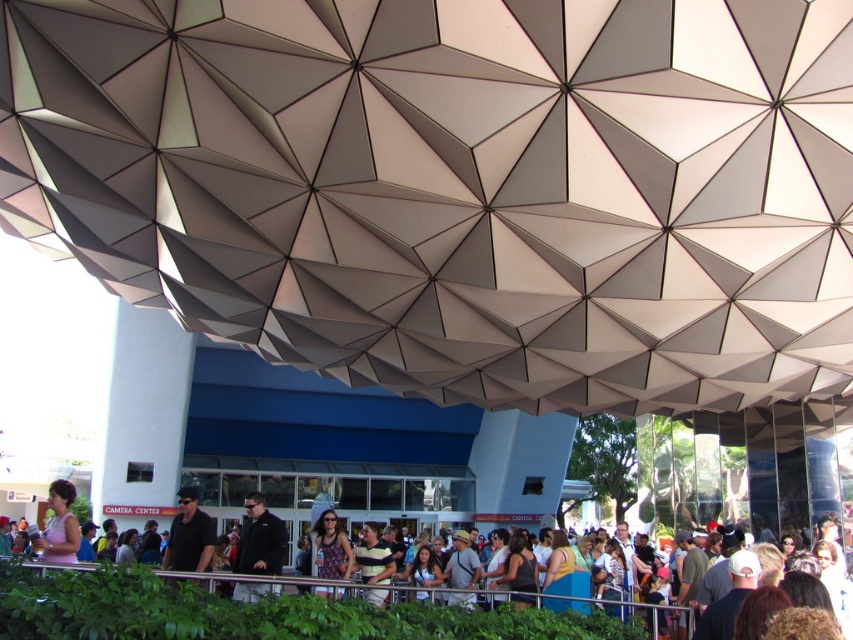
You are a photographer standing at the entrance of the building. You want to capture a photo that includes both the matte black shirt at center and the pink fabric dress at lower left. What is the minimum distance you need to move backward to ensure both subjects are in frame?

To include both the matte black shirt at center and the pink fabric dress at lower left in the photo, you need to move back at least 2.67 meters, which is the distance between them.

You are standing in front of the modern building entrance and notice two people wearing a black matte jacket at center and a dark gray fabric shirt at center. Which clothing item is closer to the ground?

The black matte jacket at center is positioned under the dark gray fabric shirt at center, so it is closer to the ground.

From the picture: You are standing at the entrance of the modern building with large glass doors and want to find someone wearing a black matte jacket at center. According to the coordinates provided, where would you look relative to the entrance?

The black matte jacket at center is located at coordinates point (259, 540), which means it is positioned towards the lower right area relative to the entrance.